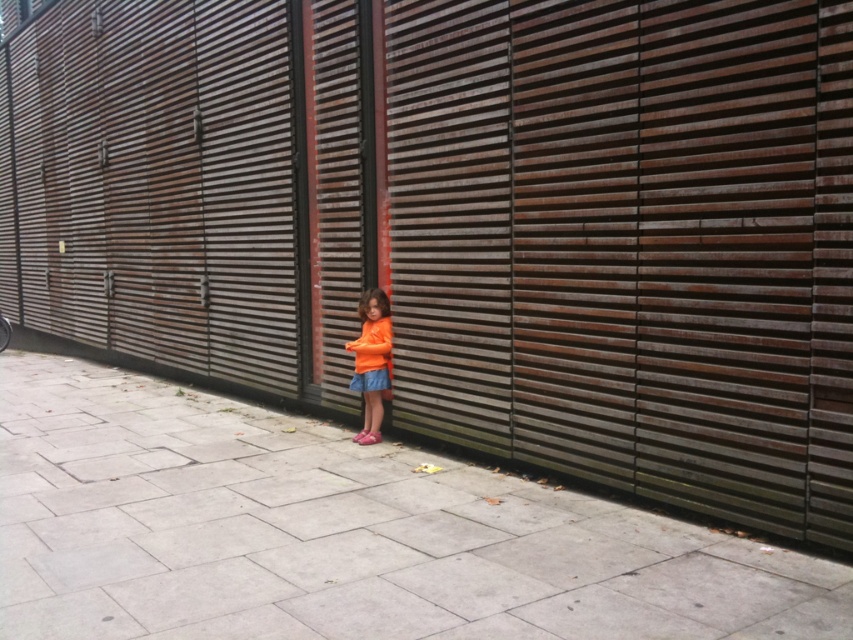
You are a parent trying to ensure your child is safe while playing near the wall. The child is wearing orange fabric shorts at center and standing on the gray concrete pavement at center. Which object is supporting the child?

The gray concrete pavement at center is positioned under orange fabric shorts at center, so the gray concrete pavement at center is supporting the child.

You are a delivery robot with a 1.2 meter wide package. You need to navigate through the area between the gray concrete pavement at center and orange matte shirt at center. Can you fit through the space between them?

The gray concrete pavement at center has a smaller size compared to orange matte shirt at center, so the space between them may be insufficient for the 1.2 meter wide package. It is recommended to find an alternative path.

You are a fashion designer observing a child wearing an orange matte shirt at center and orange fabric shorts at center. Which piece of clothing has a larger surface area?

The orange matte shirt at center has a larger surface area than the orange fabric shorts at center.